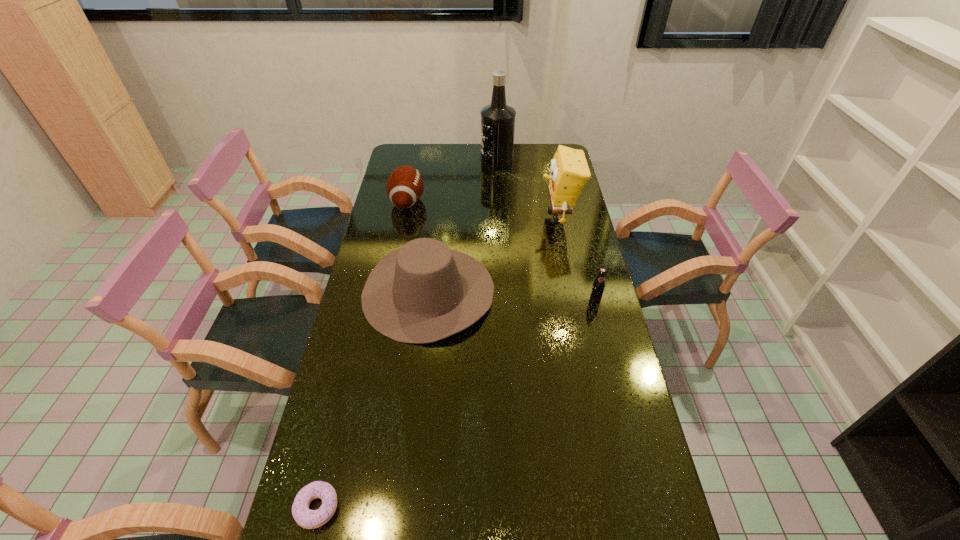
Where is `the tallest object`? the tallest object is located at coordinates pos(497,119).

This screenshot has height=540, width=960. Find the location of `the farthest object`. the farthest object is located at coordinates (497, 119).

Where is `the fifth shortest object`? the fifth shortest object is located at coordinates (569, 171).

At what (x,y) coordinates should I click in order to perform the action: click on cowboy hat. Please return your answer as a coordinate pair (x, y). Looking at the image, I should click on (423, 292).

Locate an element on the screen. football is located at coordinates (404, 186).

In order to click on pop in this screenshot , I will do `click(598, 287)`.

Where is `doughnut`? doughnut is located at coordinates (310, 519).

This screenshot has width=960, height=540. Identify the location of the shortest object. (310, 519).

Identify the location of free space located on the front label of the tallest object. (451, 160).

This screenshot has height=540, width=960. In order to click on free space located on the front label of the tallest object in this screenshot , I will do `click(439, 160)`.